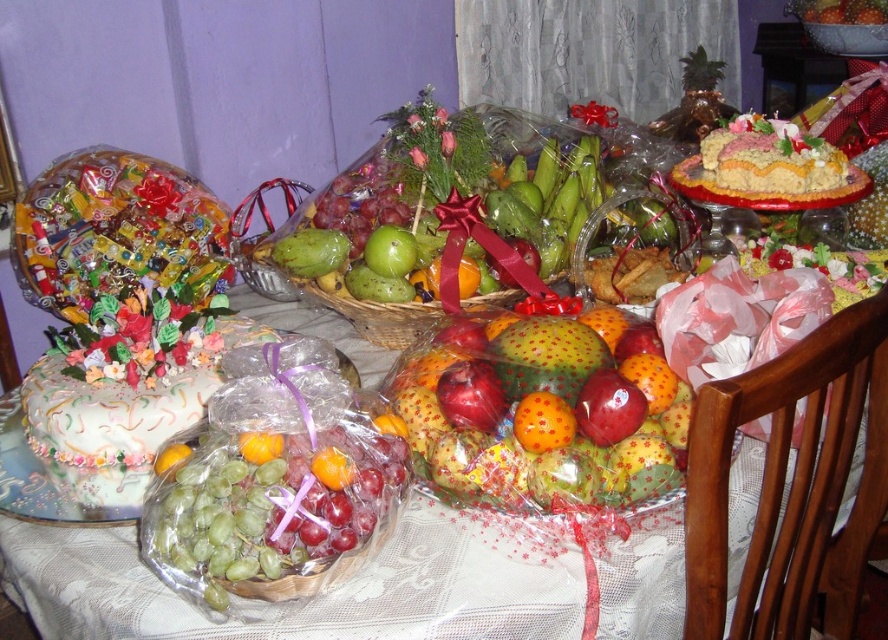
Consider the image. You are a guest at a birthday party and want to reach for the white frosted cake at lower left and the matte yellow cake at upper right. Which cake should you approach first to get the one closer to you?

You should approach the white frosted cake at lower left first because it is in front of the matte yellow cake at upper right, making it closer to you.